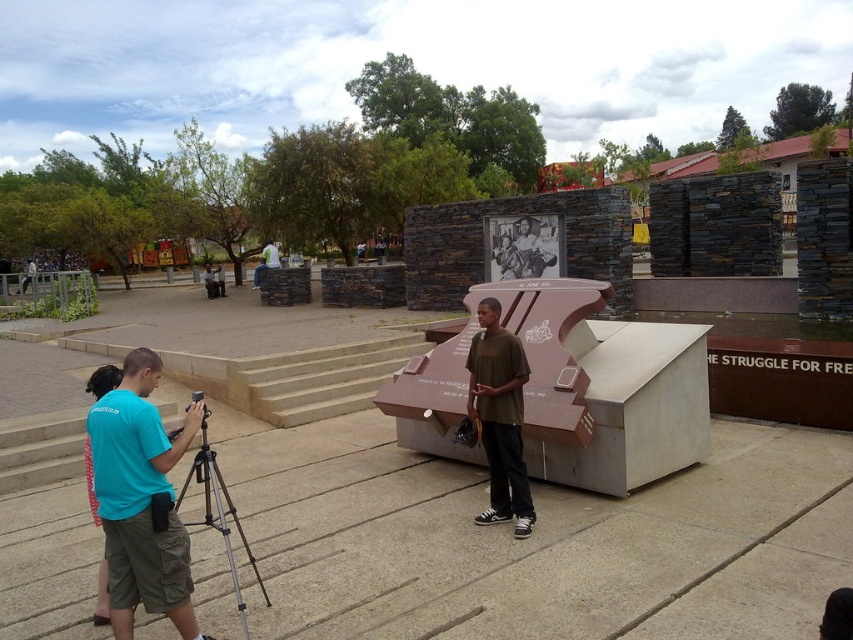
Question: Does matte brown shirt at center appear under silver metallic tripod at lower left?

Choices:
 (A) yes
 (B) no

Answer: (B)

Question: Which point is closer to the camera?

Choices:
 (A) (180, 444)
 (B) (488, 308)

Answer: (A)

Question: Can you confirm if teal fabric shirt at center is positioned to the right of silver metallic tripod at lower left?

Choices:
 (A) no
 (B) yes

Answer: (B)

Question: Among these objects, which one is nearest to the camera?

Choices:
 (A) matte brown shirt at center
 (B) teal fabric shirt at center
 (C) silver metallic tripod at lower left

Answer: (B)

Question: Which of the following is the farthest from the observer?

Choices:
 (A) teal fabric shirt at center
 (B) matte brown shirt at center

Answer: (B)

Question: Can you confirm if matte brown shirt at center is positioned to the left of silver metallic tripod at lower left?

Choices:
 (A) yes
 (B) no

Answer: (B)